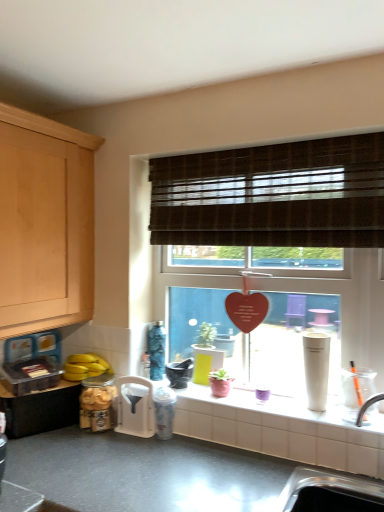
Question: Is matte black mortar at center, which is the third appliance in left-to-right order, completely or partially outside of white plastic funnel at lower center, marked as the second appliance in a right-to-left arrangement?

Choices:
 (A) yes
 (B) no

Answer: (A)

Question: Is matte black mortar at center, which is the first appliance in right-to-left order, at the right side of white plastic funnel at lower center, marked as the second appliance in a right-to-left arrangement?

Choices:
 (A) no
 (B) yes

Answer: (B)

Question: From the image's perspective, is matte black mortar at center, which is the third appliance in left-to-right order, located beneath white plastic funnel at lower center, marked as the second appliance in a right-to-left arrangement?

Choices:
 (A) no
 (B) yes

Answer: (A)

Question: Is matte black mortar at center, which is the first appliance in right-to-left order, not close to white plastic funnel at lower center, marked as the second appliance in a right-to-left arrangement?

Choices:
 (A) no
 (B) yes

Answer: (A)

Question: Is matte black mortar at center, which is the third appliance in left-to-right order, wider than white plastic funnel at lower center, positioned as the second appliance in left-to-right order?

Choices:
 (A) yes
 (B) no

Answer: (A)

Question: Is white plastic funnel at lower center, positioned as the second appliance in left-to-right order, inside the boundaries of matte white tile at center, or outside?

Choices:
 (A) inside
 (B) outside

Answer: (B)

Question: Is white plastic funnel at lower center, marked as the second appliance in a right-to-left arrangement, bigger or smaller than matte white tile at center?

Choices:
 (A) big
 (B) small

Answer: (A)

Question: From the image's perspective, relative to matte white tile at center, is white plastic funnel at lower center, marked as the second appliance in a right-to-left arrangement, above or below?

Choices:
 (A) above
 (B) below

Answer: (B)

Question: Relative to matte white tile at center, is white plastic funnel at lower center, marked as the second appliance in a right-to-left arrangement, in front or behind?

Choices:
 (A) front
 (B) behind

Answer: (B)

Question: From their relative heights in the image, would you say silver metallic sink at lower right is taller or shorter than white plastic funnel at lower center, positioned as the second appliance in left-to-right order?

Choices:
 (A) short
 (B) tall

Answer: (A)

Question: Is silver metallic sink at lower right spatially inside white plastic funnel at lower center, marked as the second appliance in a right-to-left arrangement, or outside of it?

Choices:
 (A) inside
 (B) outside

Answer: (B)

Question: From a real-world perspective, is silver metallic sink at lower right positioned above or below white plastic funnel at lower center, marked as the second appliance in a right-to-left arrangement?

Choices:
 (A) above
 (B) below

Answer: (B)

Question: In terms of size, does silver metallic sink at lower right appear bigger or smaller than white plastic funnel at lower center, marked as the second appliance in a right-to-left arrangement?

Choices:
 (A) big
 (B) small

Answer: (A)

Question: Visually, is yellow matte bananas at lower left positioned to the left or to the right of matte white tile at center?

Choices:
 (A) left
 (B) right

Answer: (A)

Question: Looking at the image, does yellow matte bananas at lower left seem bigger or smaller compared to matte white tile at center?

Choices:
 (A) small
 (B) big

Answer: (B)